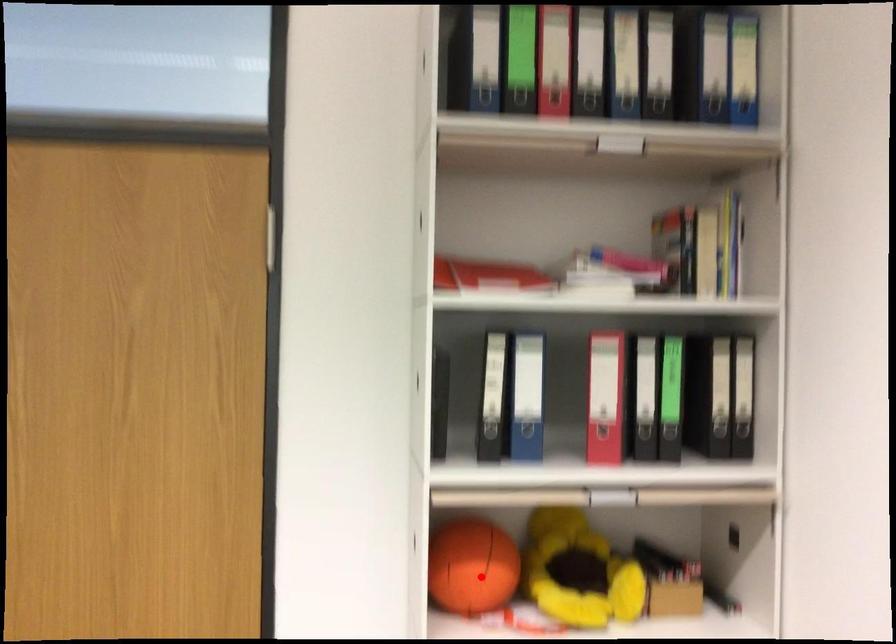
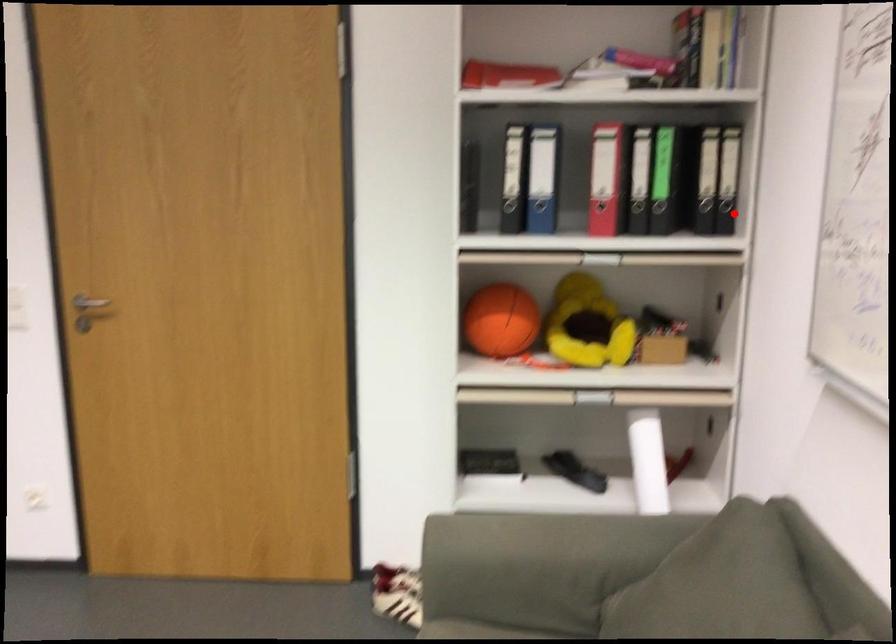
I am providing you with two images of the same scene from different viewpoints. A red point is marked on the first image and another point is marked on the second image. Is the red point in image1 aligned with the point shown in image2?

No